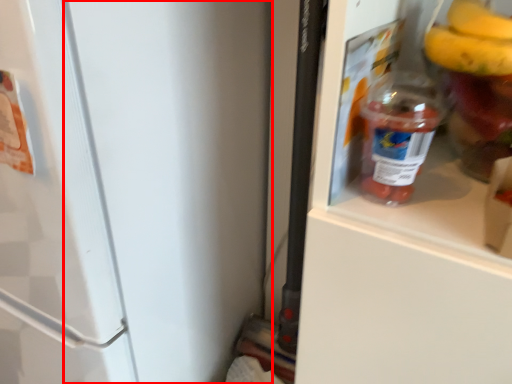
Question: From the image's perspective, where is door (annotated by the red box) located in relation to bottle in the image?

Choices:
 (A) above
 (B) below

Answer: (B)